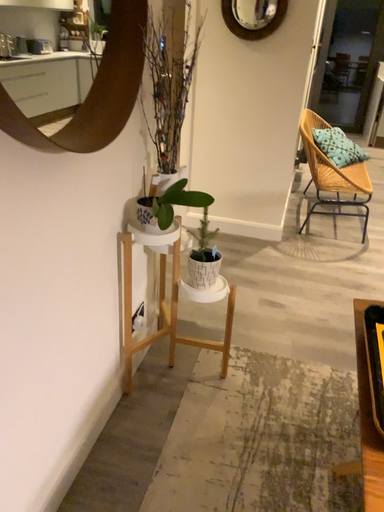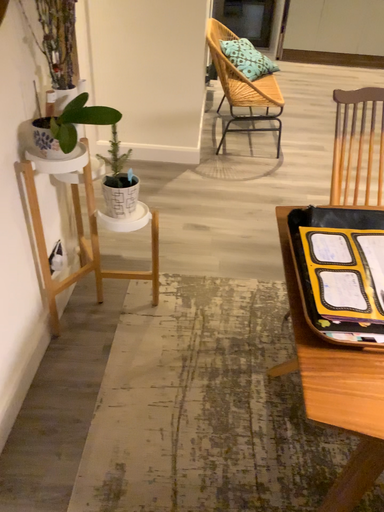
Question: Which way did the camera rotate in the video?

Choices:
 (A) rotated upward
 (B) rotated downward

Answer: (B)